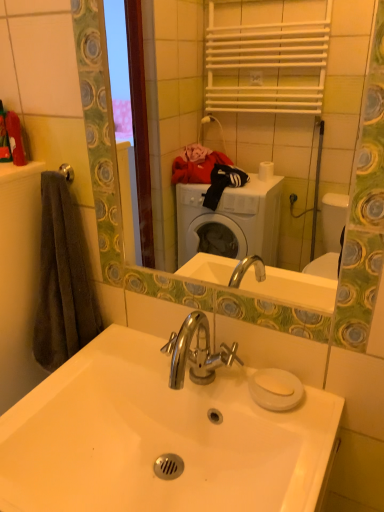
Question: Does white glossy sink at center appear on the left side of silver metallic towel bar at upper left?

Choices:
 (A) no
 (B) yes

Answer: (A)

Question: From the image's perspective, is white glossy sink at center below silver metallic towel bar at upper left?

Choices:
 (A) yes
 (B) no

Answer: (A)

Question: Is white glossy sink at center closer to camera compared to silver metallic towel bar at upper left?

Choices:
 (A) no
 (B) yes

Answer: (B)

Question: Is white glossy sink at center further to camera compared to silver metallic towel bar at upper left?

Choices:
 (A) yes
 (B) no

Answer: (B)

Question: Could you tell me if white glossy sink at center is facing silver metallic towel bar at upper left?

Choices:
 (A) yes
 (B) no

Answer: (B)

Question: Is dark gray towel at left bigger or smaller than white glossy sink at center?

Choices:
 (A) small
 (B) big

Answer: (A)

Question: Considering the positions of dark gray towel at left and white glossy sink at center in the image, is dark gray towel at left wider or thinner than white glossy sink at center?

Choices:
 (A) thin
 (B) wide

Answer: (A)

Question: Would you say dark gray towel at left is inside or outside white glossy sink at center?

Choices:
 (A) inside
 (B) outside

Answer: (B)

Question: Is point (89, 304) closer or farther from the camera than point (210, 433)?

Choices:
 (A) farther
 (B) closer

Answer: (A)

Question: Is dark gray towel at left inside the boundaries of silver metallic towel bar at upper left, or outside?

Choices:
 (A) inside
 (B) outside

Answer: (B)

Question: From a real-world perspective, is dark gray towel at left above or below silver metallic towel bar at upper left?

Choices:
 (A) below
 (B) above

Answer: (A)

Question: From the image's perspective, relative to silver metallic towel bar at upper left, is dark gray towel at left above or below?

Choices:
 (A) above
 (B) below

Answer: (B)

Question: Does point (59, 202) appear closer or farther from the camera than point (67, 175)?

Choices:
 (A) farther
 (B) closer

Answer: (B)

Question: Is point (66, 180) closer or farther from the camera than point (173, 442)?

Choices:
 (A) closer
 (B) farther

Answer: (B)

Question: Is silver metallic towel bar at upper left taller or shorter than white glossy sink at center?

Choices:
 (A) short
 (B) tall

Answer: (A)